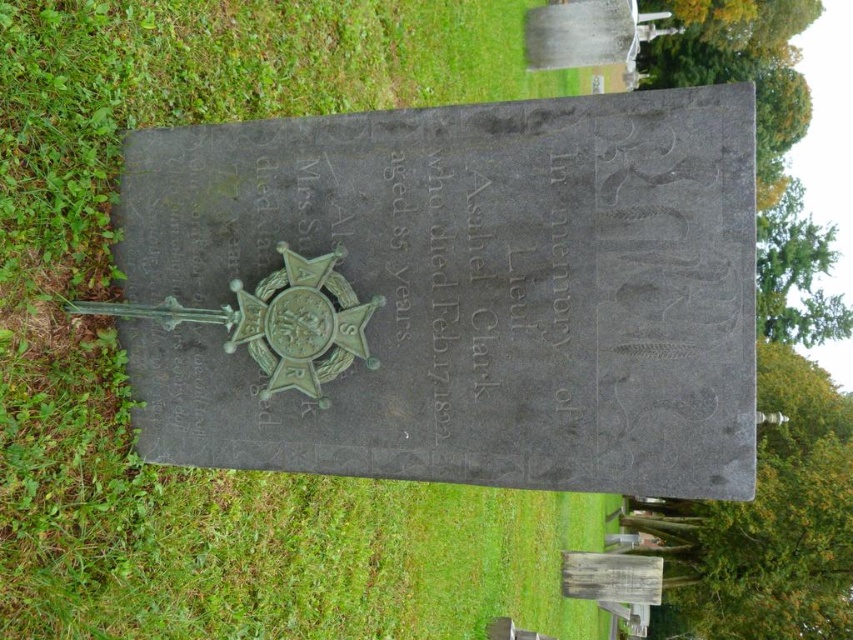
Between green stone plaque at center and green grass at center, which one appears on the left side from the viewer's perspective?

green stone plaque at center is more to the left.

This screenshot has height=640, width=853. What do you see at coordinates (463, 291) in the screenshot? I see `green stone plaque at center` at bounding box center [463, 291].

Which is behind, point (117, 259) or point (392, 24)?

The point (392, 24) is behind.

Locate an element on the screen. The image size is (853, 640). green stone plaque at center is located at coordinates [463, 291].